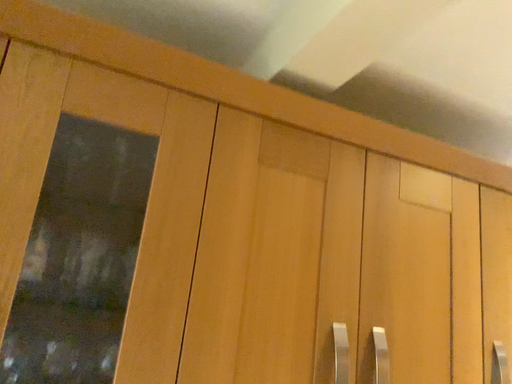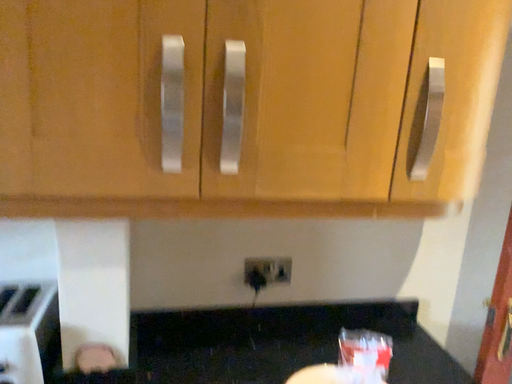
Question: Which way did the camera rotate in the video?

Choices:
 (A) rotated right
 (B) rotated left

Answer: (B)